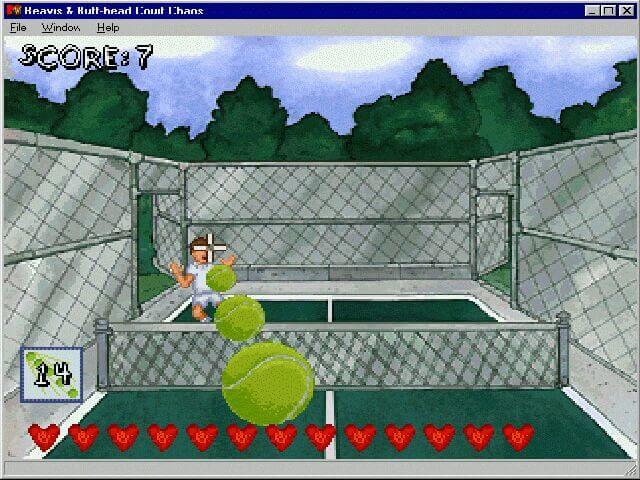
You are a GUI agent. You are given a task and a screenshot of the screen. Output one action in this format:
    pyautogui.click(x=<x>, y=<y>)
    Task: Click on the window
    The image size is (640, 480).
    Given the screenshot: What is the action you would take?
    pyautogui.click(x=225, y=0)